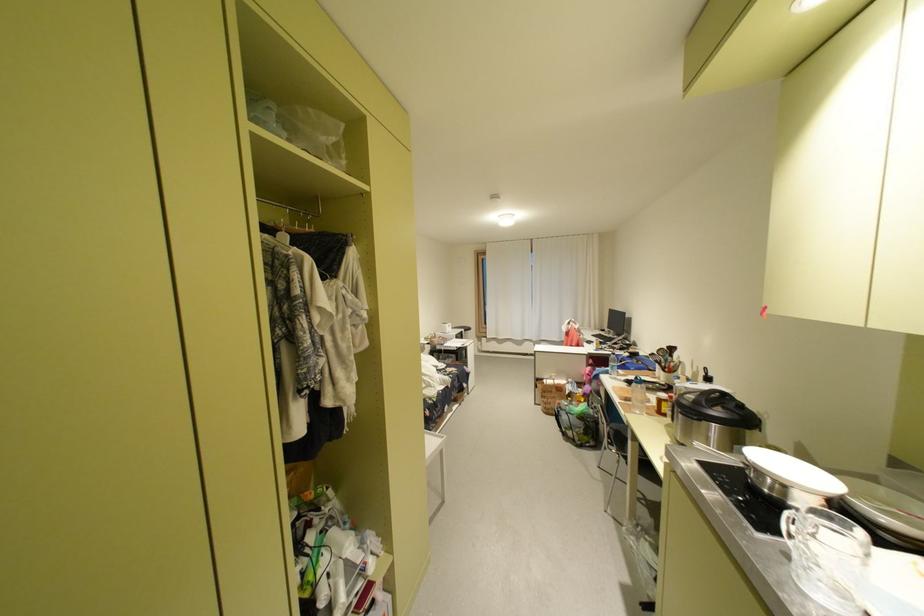
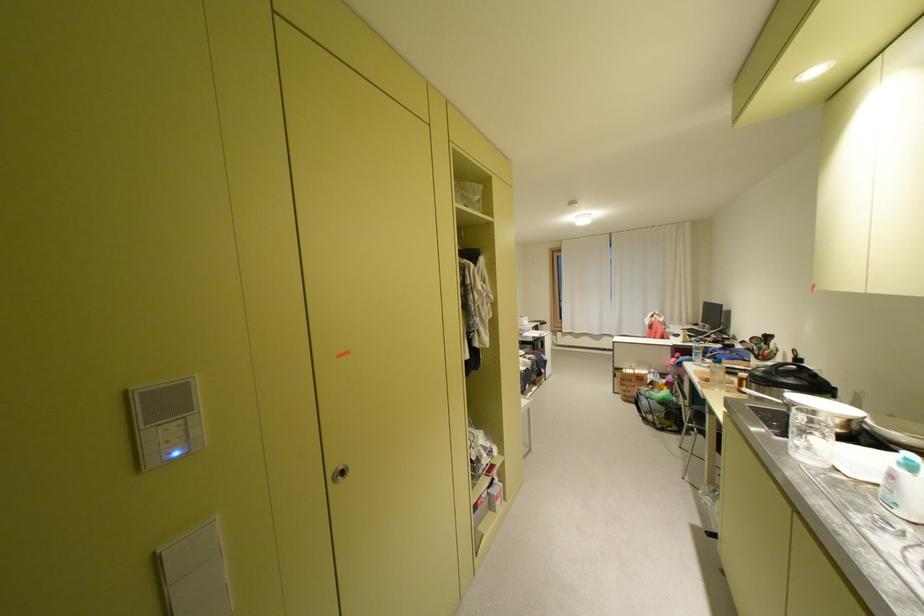
Question: Which direction would the cameraman need to move to produce the second image? Reply with the corresponding letter.

Choices:
 (A) Left
 (B) Right
 (C) Forward
 (D) Backward

Answer: (D)